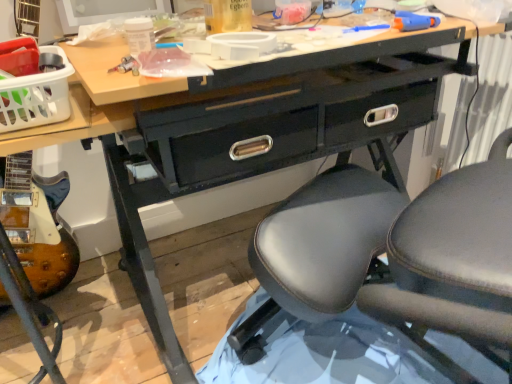
Question: Should I look upward or downward to see wooden electric guitar at lower left?

Choices:
 (A) down
 (B) up

Answer: (A)

Question: Is black leather chair at center to the left of white plastic basket at upper left from the viewer's perspective?

Choices:
 (A) no
 (B) yes

Answer: (A)

Question: From a real-world perspective, is black leather chair at center located beneath white plastic basket at upper left?

Choices:
 (A) yes
 (B) no

Answer: (A)

Question: From a real-world perspective, is black leather chair at center physically above white plastic basket at upper left?

Choices:
 (A) yes
 (B) no

Answer: (B)

Question: Does black leather chair at center have a greater height compared to white plastic basket at upper left?

Choices:
 (A) no
 (B) yes

Answer: (B)

Question: Is black leather chair at center thinner than white plastic basket at upper left?

Choices:
 (A) no
 (B) yes

Answer: (A)

Question: Is black leather chair at center facing towards white plastic basket at upper left?

Choices:
 (A) yes
 (B) no

Answer: (B)

Question: Could you tell me if wooden electric guitar at lower left is facing black leather chair at center?

Choices:
 (A) no
 (B) yes

Answer: (A)

Question: Is wooden electric guitar at lower left at the left side of black leather chair at center?

Choices:
 (A) yes
 (B) no

Answer: (A)

Question: From a real-world perspective, is wooden electric guitar at lower left on black leather chair at center?

Choices:
 (A) yes
 (B) no

Answer: (B)

Question: From the image's perspective, is wooden electric guitar at lower left below black leather chair at center?

Choices:
 (A) yes
 (B) no

Answer: (A)

Question: Considering the relative positions of wooden electric guitar at lower left and black leather chair at center in the image provided, is wooden electric guitar at lower left to the right of black leather chair at center from the viewer's perspective?

Choices:
 (A) yes
 (B) no

Answer: (B)

Question: Can you confirm if wooden electric guitar at lower left is taller than black leather chair at center?

Choices:
 (A) no
 (B) yes

Answer: (A)

Question: Is black leather chair at center directly adjacent to wooden electric guitar at lower left?

Choices:
 (A) yes
 (B) no

Answer: (B)